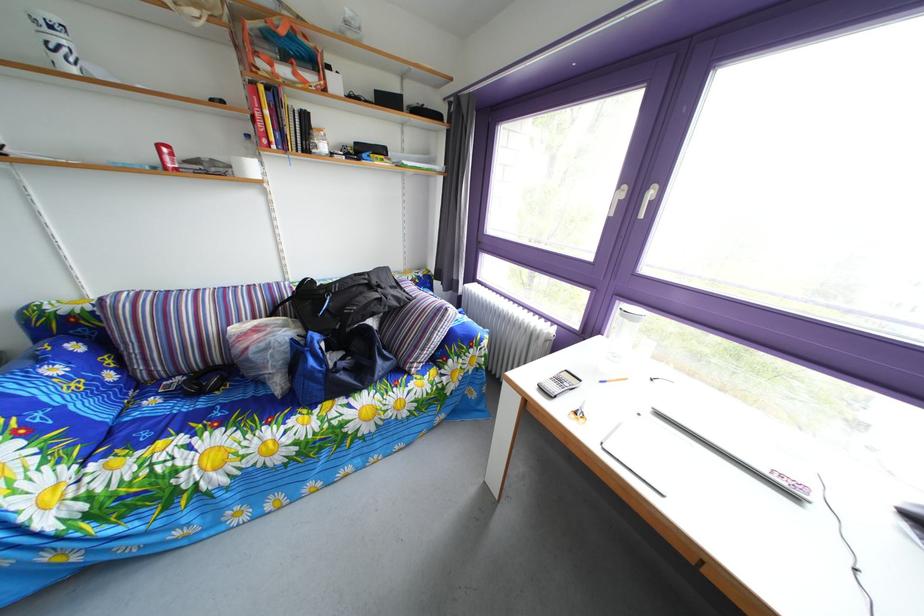
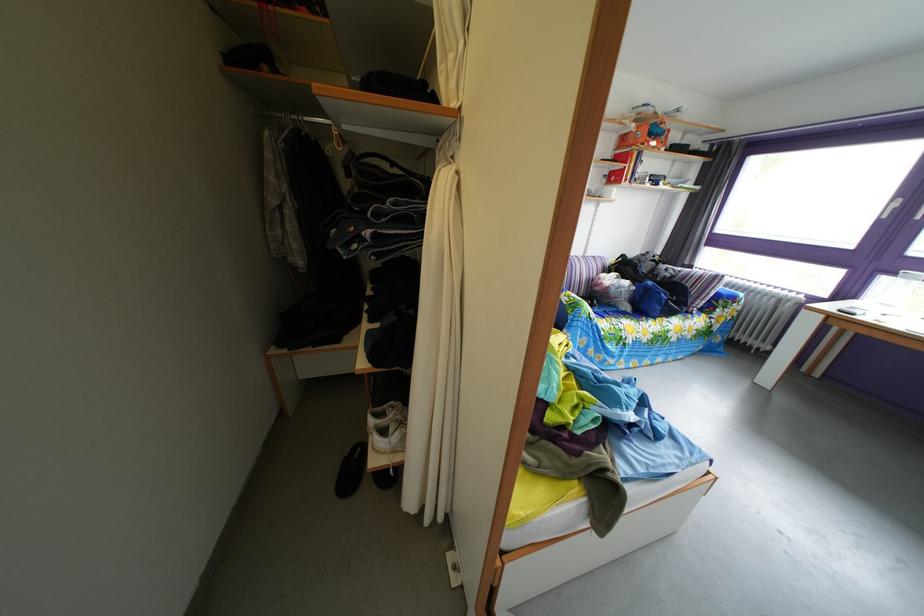
Locate, in the second image, the point that corresponds to pixel 295 282 in the first image.

(596, 261)